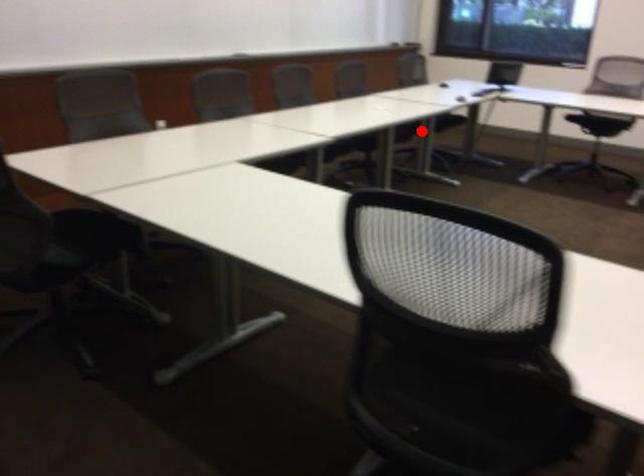
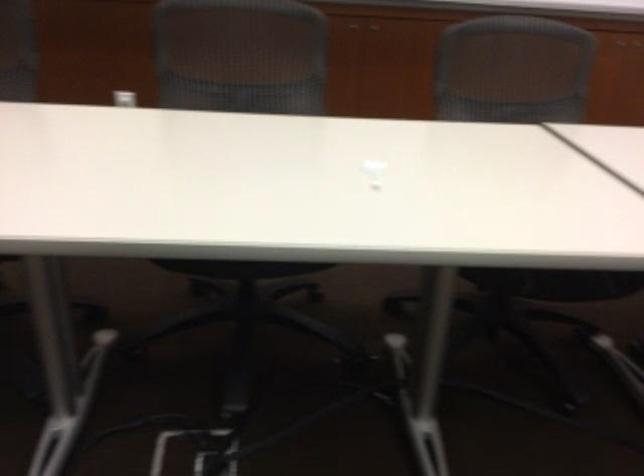
Question: I am providing you with two images of the same scene from different viewpoints. In image1, a red point is highlighted. Considering the same 3D point in image2, which of the following is correct?

Choices:
 (A) It is closer
 (B) It is farther

Answer: (A)